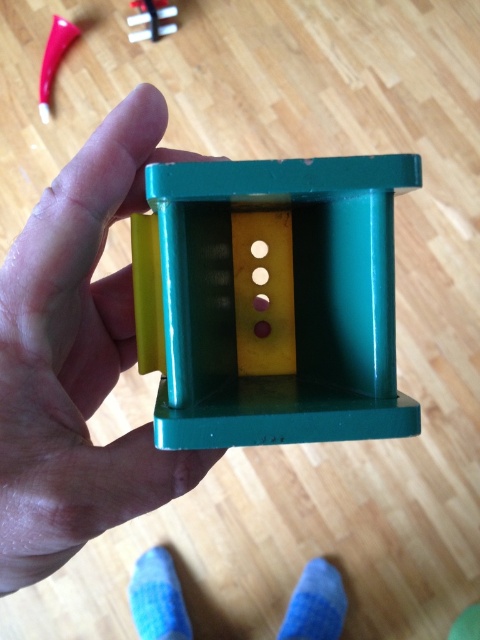
Question: Can you confirm if green plastic hand at center is positioned to the right of blue fuzzy sock at lower center?

Choices:
 (A) yes
 (B) no

Answer: (B)

Question: Which point appears closest to the camera in this image?

Choices:
 (A) (158, 35)
 (B) (316, 593)
 (C) (153, 230)

Answer: (C)

Question: Which of these objects is positioned farthest from the blue fuzzy sock at lower center?

Choices:
 (A) blue fuzzy sock at lower left
 (B) green plastic hand at center

Answer: (B)

Question: Which object is farther from the camera taking this photo?

Choices:
 (A) blue fuzzy sock at lower center
 (B) green plastic hand at center
 (C) green plastic toy at center
 (D) blue fuzzy sock at lower left

Answer: (D)

Question: Where is green plastic hand at center located in relation to matte plastic toy at upper center in the image?

Choices:
 (A) above
 (B) below

Answer: (B)

Question: Does green plastic toy at center appear over blue fuzzy sock at lower center?

Choices:
 (A) no
 (B) yes

Answer: (B)